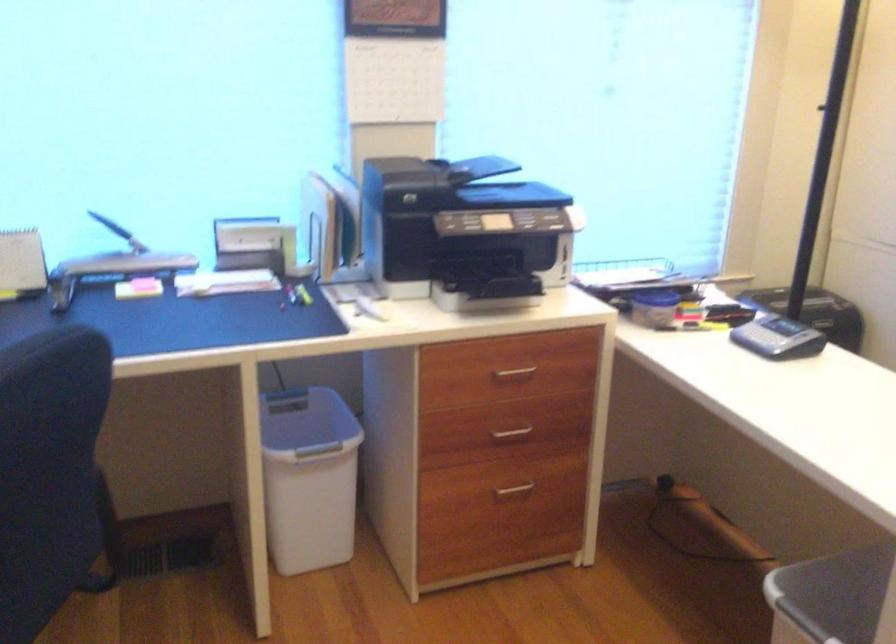
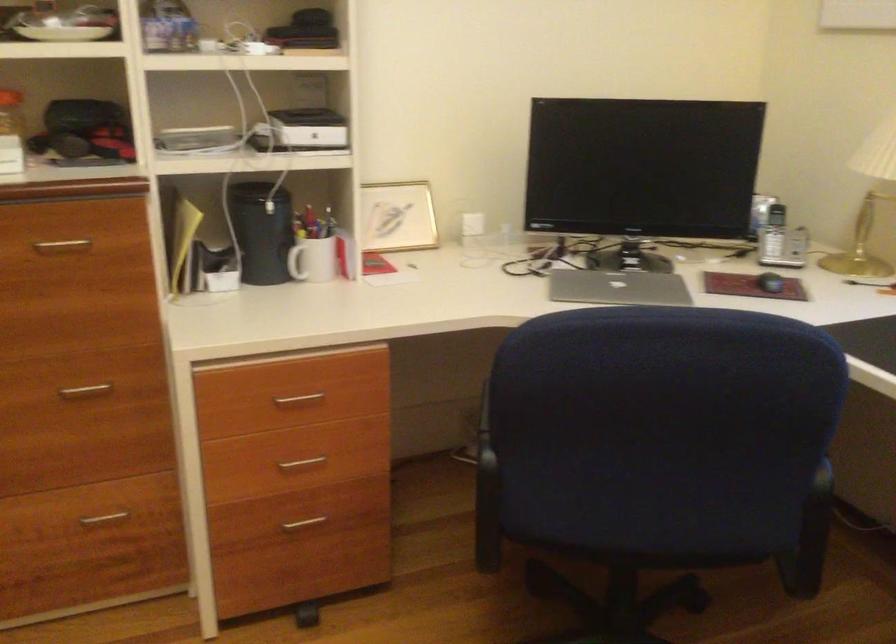
First-person continuous shooting, in which direction is the camera rotating?

The rotation direction of the camera is left-down.